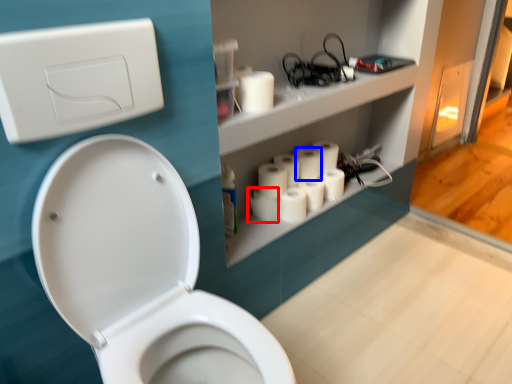
Question: Which of the following is the closest to the observer, toilet paper (highlighted by a red box) or toilet paper (highlighted by a blue box)?

Choices:
 (A) toilet paper
 (B) toilet paper

Answer: (A)